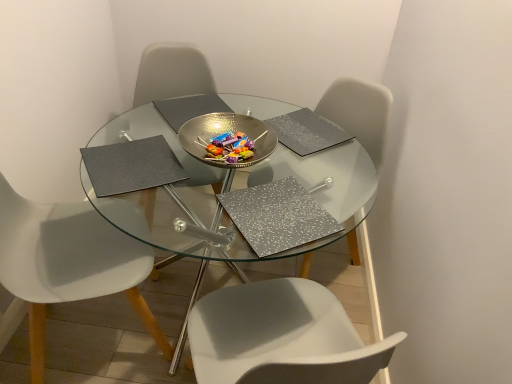
Question: Should I look upward or downward to see gray matte placemat at upper left, which is counted as the third pad, starting from the right?

Choices:
 (A) up
 (B) down

Answer: (A)

Question: Is transparent glass table at center not close to white plastic chair at center, arranged as the 3th chair when viewed from the left?

Choices:
 (A) no
 (B) yes

Answer: (A)

Question: Is white plastic chair at center, acting as the 1th chair starting from the right, at the back of transparent glass table at center?

Choices:
 (A) no
 (B) yes

Answer: (B)

Question: From the image's perspective, would you say transparent glass table at center is shown under white plastic chair at center, arranged as the 3th chair when viewed from the left?

Choices:
 (A) no
 (B) yes

Answer: (B)

Question: Can you confirm if transparent glass table at center is positioned to the left of white plastic chair at center, arranged as the 3th chair when viewed from the left?

Choices:
 (A) no
 (B) yes

Answer: (B)

Question: Could you tell me if transparent glass table at center is turned towards white plastic chair at center, acting as the 1th chair starting from the right?

Choices:
 (A) yes
 (B) no

Answer: (B)

Question: From the image's perspective, does transparent glass table at center appear higher than white plastic chair at center, arranged as the 3th chair when viewed from the left?

Choices:
 (A) yes
 (B) no

Answer: (B)

Question: From the image's perspective, does metallic bowl at center appear higher than gray matte placemat at upper left, the first pad when ordered from left to right?

Choices:
 (A) yes
 (B) no

Answer: (A)

Question: Does metallic bowl at center lie behind gray matte placemat at upper left, the first pad when ordered from left to right?

Choices:
 (A) yes
 (B) no

Answer: (A)

Question: Is metallic bowl at center far from gray matte placemat at upper left, which is counted as the third pad, starting from the right?

Choices:
 (A) yes
 (B) no

Answer: (B)

Question: Does metallic bowl at center appear on the left side of gray matte placemat at upper left, the first pad when ordered from left to right?

Choices:
 (A) yes
 (B) no

Answer: (B)

Question: Is metallic bowl at center facing away from gray matte placemat at upper left, the first pad when ordered from left to right?

Choices:
 (A) no
 (B) yes

Answer: (A)

Question: Does metallic bowl at center have a lesser width compared to gray matte placemat at upper left, the first pad when ordered from left to right?

Choices:
 (A) no
 (B) yes

Answer: (A)

Question: Is transparent glass table at center positioned in front of metallic bowl at center?

Choices:
 (A) yes
 (B) no

Answer: (A)